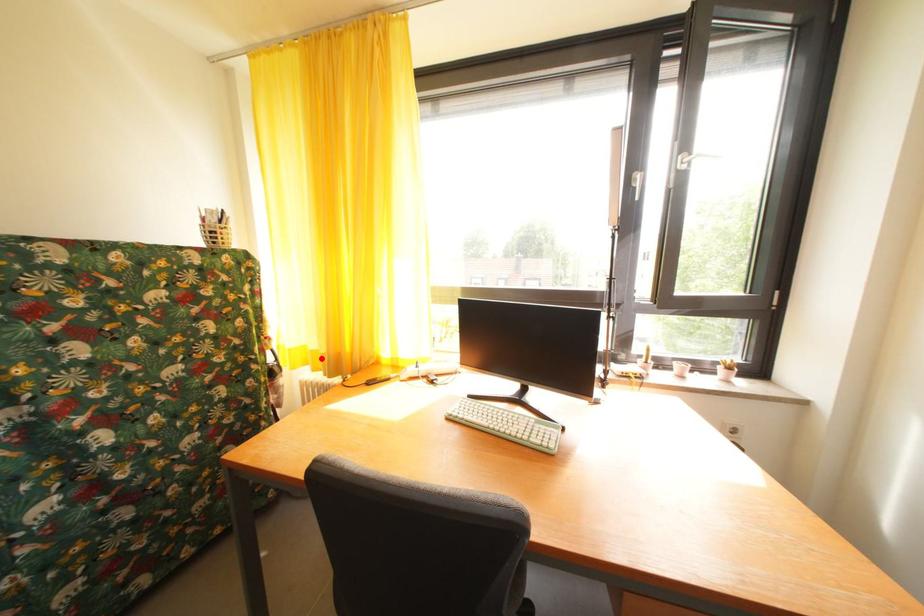
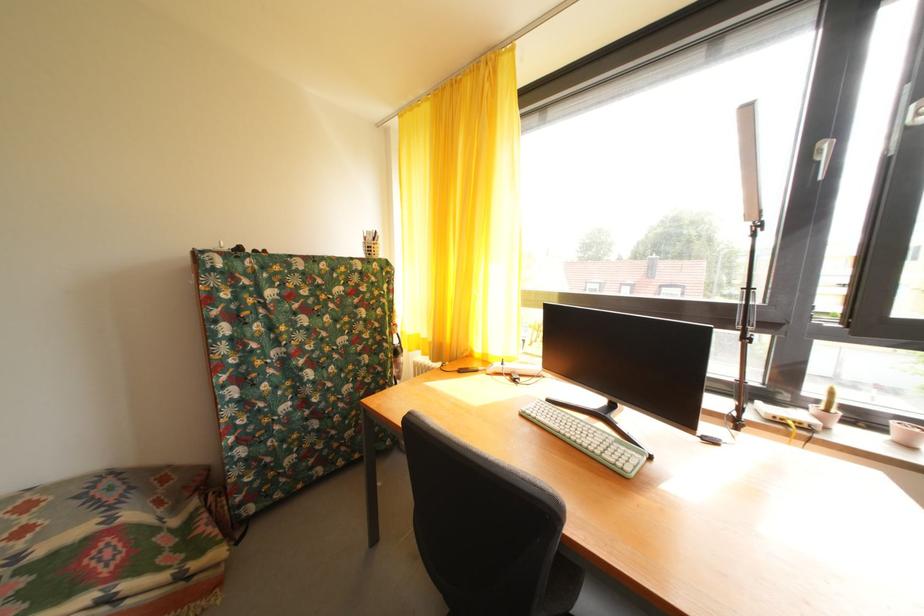
Locate, in the second image, the point that corresponds to the highlighted location in the first image.

(432, 346)